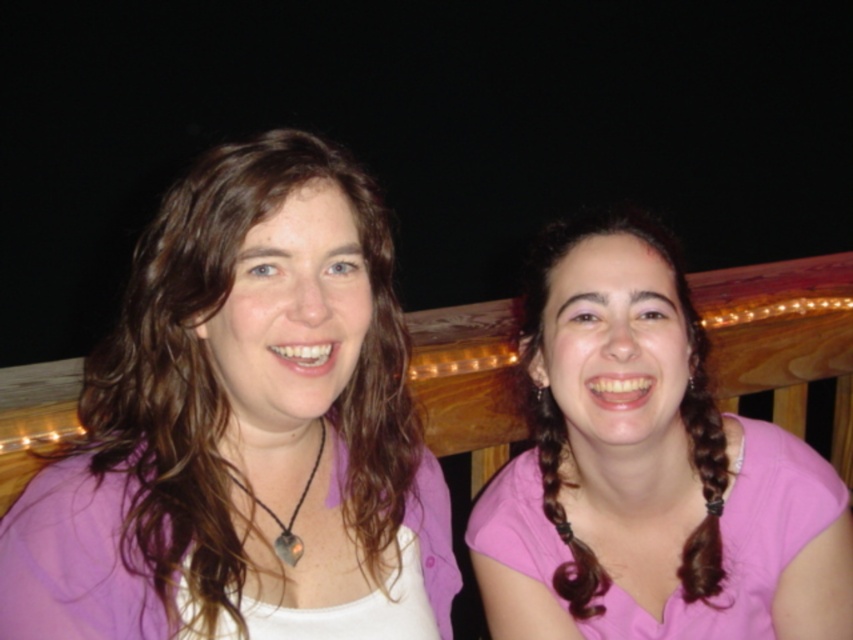
Question: Which of the following is the closest to the observer?

Choices:
 (A) pink matte shirt at right
 (B) matte purple shirt at center

Answer: (B)

Question: Which point appears closest to the camera in this image?

Choices:
 (A) click(x=350, y=520)
 (B) click(x=547, y=282)

Answer: (A)

Question: Does matte purple shirt at center have a larger size compared to pink matte shirt at right?

Choices:
 (A) no
 (B) yes

Answer: (B)

Question: Which object appears farthest from the camera in this image?

Choices:
 (A) pink matte shirt at right
 (B) matte purple shirt at center

Answer: (A)

Question: Does matte purple shirt at center appear under pink matte shirt at right?

Choices:
 (A) yes
 (B) no

Answer: (B)

Question: Is matte purple shirt at center closer to camera compared to pink matte shirt at right?

Choices:
 (A) no
 (B) yes

Answer: (B)